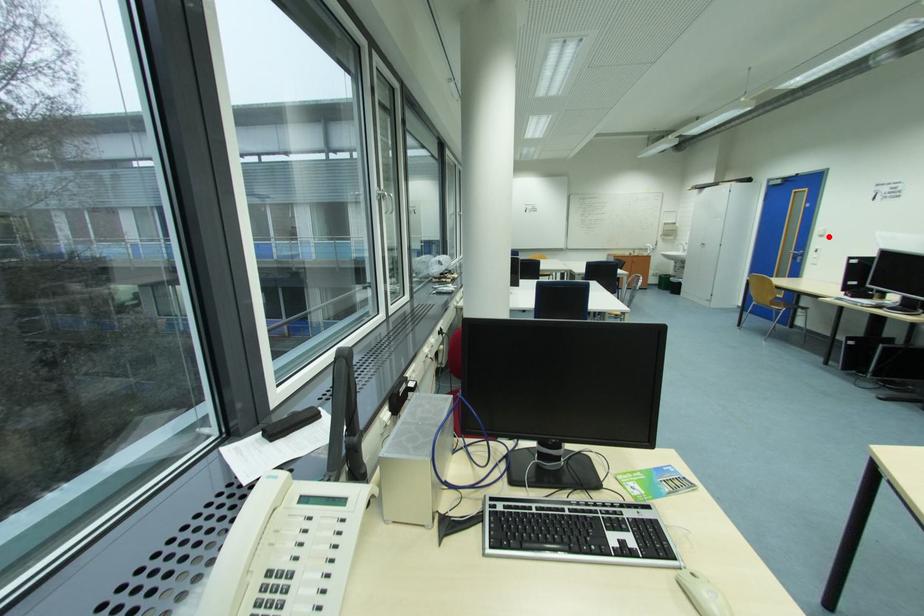
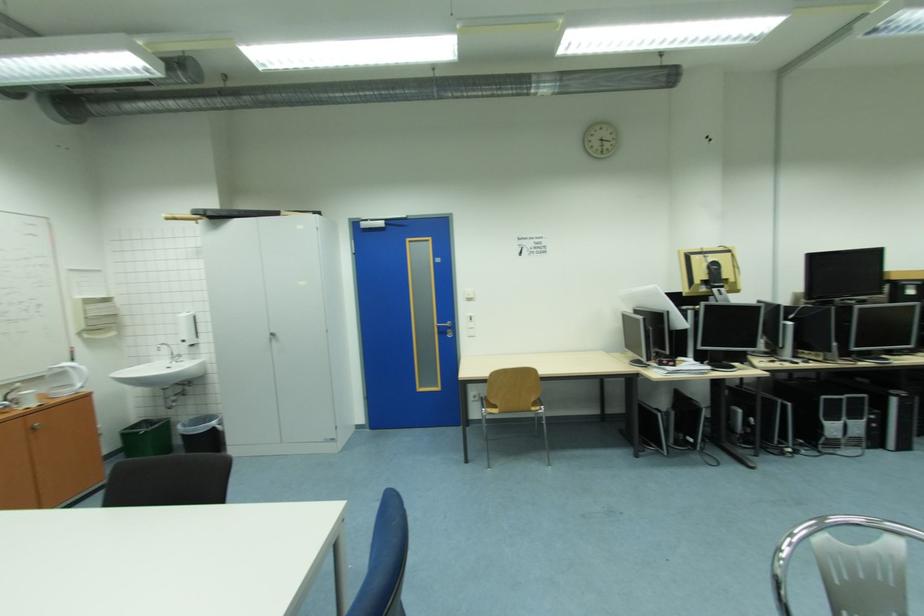
In the second image, find the point that corresponds to the highlighted location in the first image.

(477, 301)